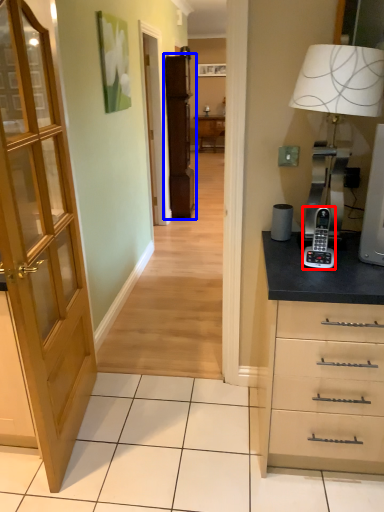
Question: Which object appears farthest to the camera in this image, gadget (highlighted by a red box) or file cabinet (highlighted by a blue box)?

Choices:
 (A) gadget
 (B) file cabinet

Answer: (B)